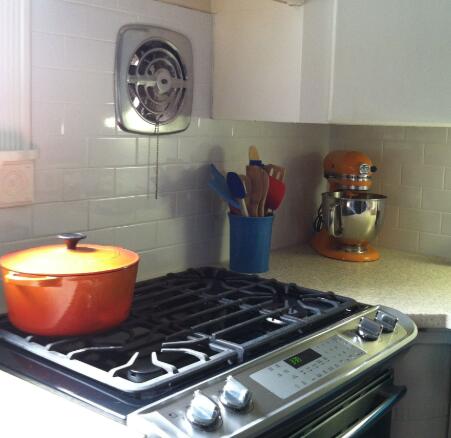
Find the location of a particular element. stand mixer is located at coordinates (350, 174).